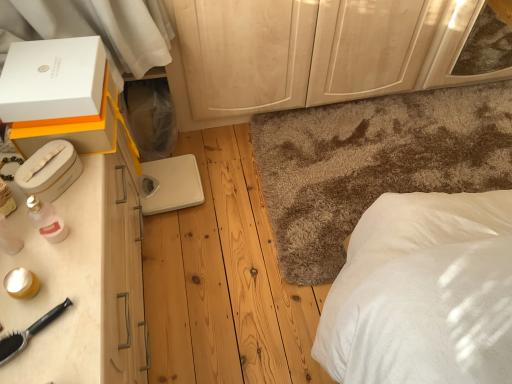
What do you see at coordinates (75, 129) in the screenshot? I see `white cardboard box at upper left, which is counted as the 2th box, starting from the top` at bounding box center [75, 129].

You are a GUI agent. You are given a task and a screenshot of the screen. Output one action in this format:
    pyautogui.click(x=<x>, y=<y>)
    Task: Click on the white cardboard box at upper left, which is counted as the 2th box, starting from the top
    The image size is (512, 384).
    Given the screenshot: What is the action you would take?
    pyautogui.click(x=75, y=129)

Locate an element on the screen. This screenshot has height=384, width=512. light wood dresser at center is located at coordinates (368, 47).

What do you see at coordinates (50, 171) in the screenshot? I see `white plastic box at left, marked as the 1th box in a bottom-to-top arrangement` at bounding box center [50, 171].

This screenshot has height=384, width=512. What are the coordinates of `shaggy carpet at center` in the screenshot? It's located at (374, 163).

Looking at this image, from the image's perspective, relative to shaggy carpet at center, is white cardboard box at upper left, the 2th box ordered from the bottom, above or below?

From the image's perspective, white cardboard box at upper left, the 2th box ordered from the bottom, appears above shaggy carpet at center.

Looking at this image, considering the relative sizes of white cardboard box at upper left, the 2th box ordered from the bottom, and shaggy carpet at center in the image provided, is white cardboard box at upper left, the 2th box ordered from the bottom, taller than shaggy carpet at center?

Yes, white cardboard box at upper left, the 2th box ordered from the bottom, is taller than shaggy carpet at center.

Is white cardboard box at upper left, the 2th box ordered from the bottom, thinner than shaggy carpet at center?

Yes.

How much distance is there between white plastic scale at center and pink glass perfume at left?

white plastic scale at center is 27.12 inches from pink glass perfume at left.

Considering the relative sizes of white plastic scale at center and pink glass perfume at left in the image provided, is white plastic scale at center thinner than pink glass perfume at left?

No, white plastic scale at center is not thinner than pink glass perfume at left.

Consider the image. Is white plastic scale at center positioned with its back to pink glass perfume at left?

No, white plastic scale at center's orientation is not away from pink glass perfume at left.

Locate an element on the screen. toiletry that appears below the white plastic scale at center (from the image's perspective) is located at coordinates (47, 220).

Who is bigger, light wood dresser at center or pink glass perfume at left?

With larger size is light wood dresser at center.

Where is `toiletry below the light wood dresser at center (from the image's perspective)`? toiletry below the light wood dresser at center (from the image's perspective) is located at coordinates (47, 220).

Visually, is light wood dresser at center positioned to the left or to the right of pink glass perfume at left?

light wood dresser at center is to the right of pink glass perfume at left.

Is light wood dresser at center positioned with its back to pink glass perfume at left?

No, light wood dresser at center is not facing away from pink glass perfume at left.

Does white cardboard box at upper left, the 2th box ordered from the bottom, have a larger size compared to white plastic scale at center?

Indeed, white cardboard box at upper left, the 2th box ordered from the bottom, has a larger size compared to white plastic scale at center.

Is white cardboard box at upper left, which is counted as the 2th box, starting from the top, completely or partially outside of white plastic scale at center?

Yes.

Can you confirm if white cardboard box at upper left, the 2th box ordered from the bottom, is thinner than white plastic scale at center?

Indeed, white cardboard box at upper left, the 2th box ordered from the bottom, has a lesser width compared to white plastic scale at center.

How many degrees apart are the facing directions of pink glass perfume at left and light wood dresser at center?

The angular difference between pink glass perfume at left and light wood dresser at center is 92.9 degrees.

Which object is thinner, pink glass perfume at left or light wood dresser at center?

pink glass perfume at left is thinner.

Considering the positions of points (49, 206) and (421, 39), is point (49, 206) farther from camera compared to point (421, 39)?

No, (49, 206) is in front of (421, 39).

Does white plastic scale at center touch white plastic box at left, marked as the 1th box in a bottom-to-top arrangement?

No, white plastic scale at center is not in contact with white plastic box at left, marked as the 1th box in a bottom-to-top arrangement.

Is white plastic scale at center outside of white plastic box at left, which appears as the 3th box when viewed from the top?

Yes.

Considering the sizes of objects white plastic scale at center and white plastic box at left, marked as the 1th box in a bottom-to-top arrangement, in the image provided, who is wider, white plastic scale at center or white plastic box at left, marked as the 1th box in a bottom-to-top arrangement,?

Wider between the two is white plastic scale at center.

Which box is the 1st one when counting from the left side of the shaggy carpet at center? Please provide its 2D coordinates.

[(75, 129)]

From a real-world perspective, relative to white cardboard box at upper left, which is counted as the 2th box, starting from the top, is shaggy carpet at center vertically above or below?

Clearly, from a real-world perspective, shaggy carpet at center is below white cardboard box at upper left, which is counted as the 2th box, starting from the top.

Which is nearer, (396, 147) or (105, 85)?

The point (105, 85) is closer.

Considering the relative sizes of shaggy carpet at center and white cardboard box at upper left, which is counted as the 2th box, starting from the top, in the image provided, is shaggy carpet at center wider than white cardboard box at upper left, which is counted as the 2th box, starting from the top,?

Indeed, shaggy carpet at center has a greater width compared to white cardboard box at upper left, which is counted as the 2th box, starting from the top.

Locate an element on the screen. mat that appears behind the white cardboard box at upper left, which is counted as the 2th box, starting from the top is located at coordinates (374, 163).

Identify the location of toiletry located on the left of white plastic scale at center. The height and width of the screenshot is (384, 512). (47, 220).

From the picture: Estimate the real-world distances between objects in this image. Which object is closer to light wood dresser at center, pink glass perfume at left or black plastic brush at lower left?

pink glass perfume at left is positioned closer to the anchor light wood dresser at center.

Looking at the image, which one is located closer to shaggy carpet at center, pink glass perfume at left or white matte box at upper left, which ranks as the 3th box in bottom-to-top order?

→ white matte box at upper left, which ranks as the 3th box in bottom-to-top order, lies closer to shaggy carpet at center than the other object.

Estimate the real-world distances between objects in this image. Which object is further from white matte box at upper left, which appears as the first box when viewed from the top, shaggy carpet at center or light wood dresser at center?

Based on the image, shaggy carpet at center appears to be further to white matte box at upper left, which appears as the first box when viewed from the top.

From the image, which object appears to be farther from white plastic scale at center, black plastic brush at lower left or light wood dresser at center?

black plastic brush at lower left is positioned further to the anchor white plastic scale at center.

Estimate the real-world distances between objects in this image. Which object is further from shaggy carpet at center, light wood dresser at center or white cardboard box at upper left, which is counted as the 2th box, starting from the top?

The object further to shaggy carpet at center is white cardboard box at upper left, which is counted as the 2th box, starting from the top.

From the image, which object appears to be nearer to white plastic box at left, marked as the 1th box in a bottom-to-top arrangement, light wood dresser at center or white plastic scale at center?

white plastic scale at center is closer to white plastic box at left, marked as the 1th box in a bottom-to-top arrangement.

Which object lies further to the anchor point shaggy carpet at center, white cardboard box at upper left, the 2th box ordered from the bottom, or pink glass perfume at left?

Based on the image, pink glass perfume at left appears to be further to shaggy carpet at center.

Looking at the image, which one is located closer to white plastic box at left, marked as the 1th box in a bottom-to-top arrangement, shaggy carpet at center or pink glass perfume at left?

pink glass perfume at left is positioned closer to the anchor white plastic box at left, marked as the 1th box in a bottom-to-top arrangement.

Find the location of a particular element. The height and width of the screenshot is (384, 512). toiletry between white cardboard box at upper left, the 2th box ordered from the bottom, and light wood dresser at center is located at coordinates (47, 220).

This screenshot has height=384, width=512. What are the coordinates of `dresser located between black plastic brush at lower left and shaggy carpet at center in the left-right direction` in the screenshot? It's located at (368, 47).

Where is `box between white cardboard box at upper left, the 2th box ordered from the bottom, and pink glass perfume at left, in the vertical direction`? Image resolution: width=512 pixels, height=384 pixels. box between white cardboard box at upper left, the 2th box ordered from the bottom, and pink glass perfume at left, in the vertical direction is located at coordinates (50, 171).

Identify the location of toiletry between white cardboard box at upper left, the 2th box ordered from the bottom, and black plastic brush at lower left vertically. This screenshot has height=384, width=512. (47, 220).